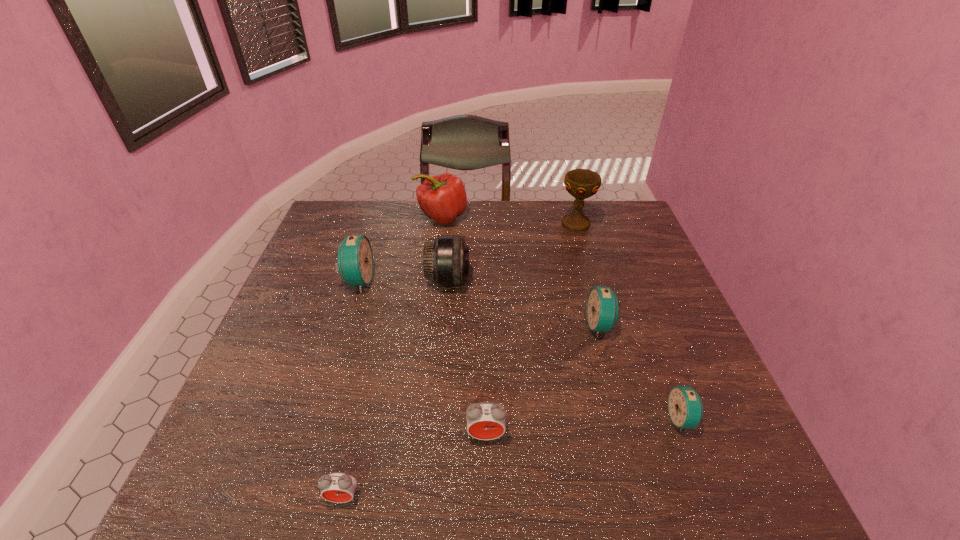
At what (x,y) coordinates should I click in order to perform the action: click on red chalice. Please return your answer as a coordinate pair (x, y). The height and width of the screenshot is (540, 960). Looking at the image, I should click on pyautogui.click(x=580, y=183).

The height and width of the screenshot is (540, 960). In order to click on pink bell pepper in this screenshot , I will do [x=442, y=198].

I want to click on the farthest alarm clock, so click(x=355, y=264).

What are the coordinates of `the biggest blue alarm clock` in the screenshot? It's located at (355, 264).

The height and width of the screenshot is (540, 960). Identify the location of telephoto lens. (446, 259).

This screenshot has width=960, height=540. In order to click on the fourth alarm clock from left to right in this screenshot , I will do `click(603, 312)`.

The image size is (960, 540). Find the location of `the second farthest alarm clock`. the second farthest alarm clock is located at coordinates (603, 312).

Locate an element on the screen. Image resolution: width=960 pixels, height=540 pixels. the right red alarm clock is located at coordinates (485, 420).

Locate an element on the screen. The height and width of the screenshot is (540, 960). the bigger red alarm clock is located at coordinates (485, 420).

This screenshot has height=540, width=960. I want to click on the smallest blue alarm clock, so click(x=685, y=407).